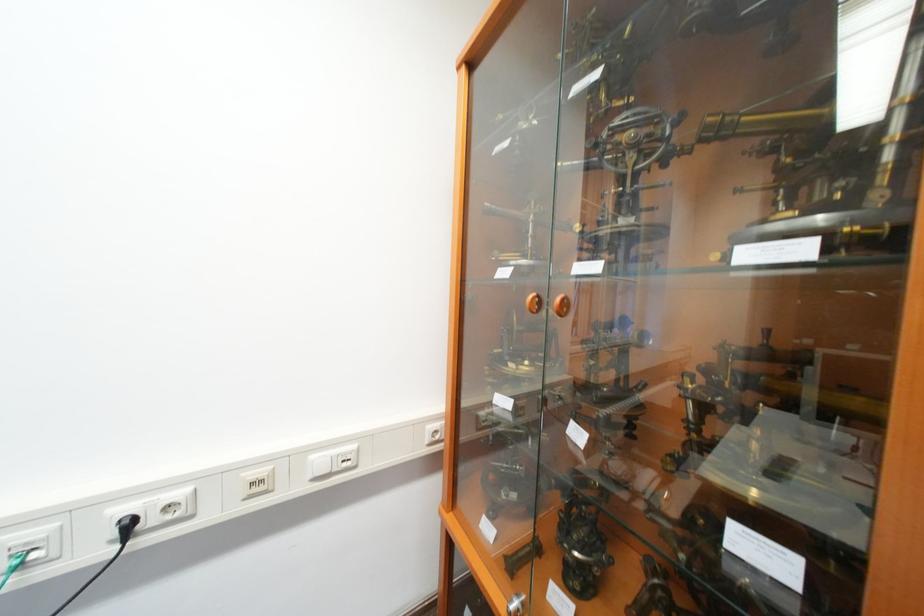
This screenshot has height=616, width=924. I want to click on large instrument wheel, so click(x=684, y=142).